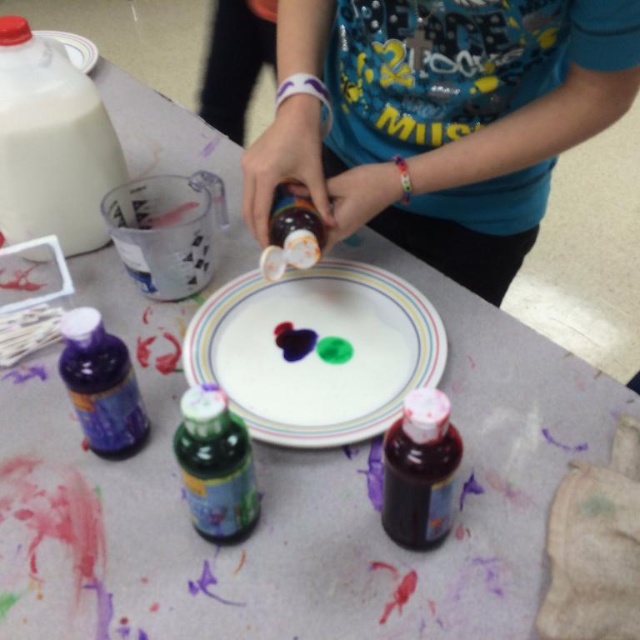
You are a parent supervising a child painting. You see the shiny plastic bottle at center and the translucent purple bottle at lower left on the table. Which bottle is positioned to the right of the other?

The shiny plastic bottle at center is to the right of the translucent purple bottle at lower left.

You are a parent observing your child painting at the table. You notice the shiny plastic bottle at center and the translucent purple bottle at lower left. Which bottle is closer to you?

The shiny plastic bottle at center is closer to you because it is further to the viewer than the translucent purple bottle at lower left.

You are a parent observing your child painting. You notice the shiny plastic bottle at center and the matte white plate at center. Which object is positioned higher from the floor?

The shiny plastic bottle at center is above the matte white plate at center, so the shiny plastic bottle at center is higher from the floor.